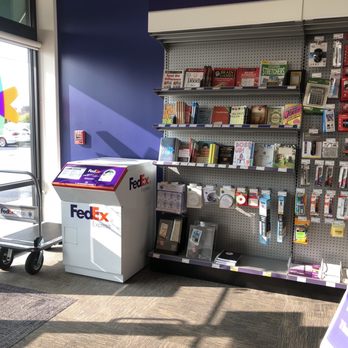
At what (x,y) coordinates should I click in order to perform the action: click on floor. Please return your answer as a coordinate pair (x, y). Looking at the image, I should click on (190, 298).